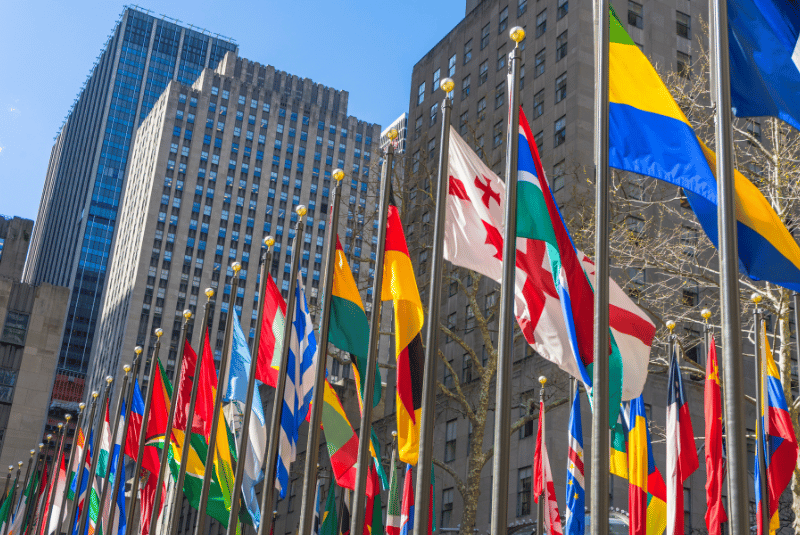
You are a GUI agent. You are given a task and a screenshot of the screen. Output one action in this format:
    pyautogui.click(x=<x>, y=<y>)
    Task: Click on the column of windows right of blue red green and white flag
    
    Given the screenshot: What is the action you would take?
    [x=562, y=12], [x=561, y=43], [x=538, y=68], [x=540, y=26], [x=538, y=106], [x=564, y=91], [x=540, y=140], [x=558, y=126], [x=556, y=174], [x=562, y=213]